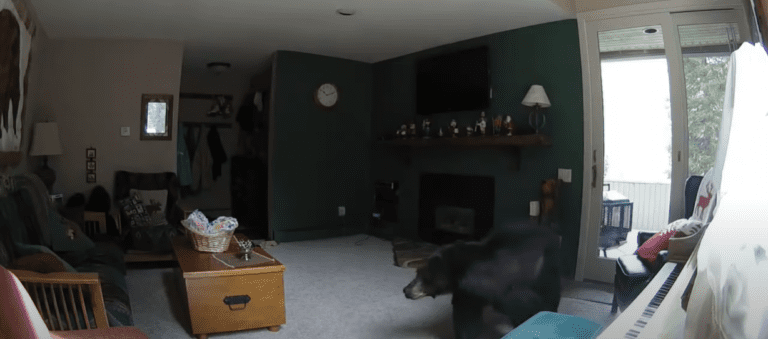
In order to click on chair on right side of the room in this screenshot , I will do `click(637, 266)`.